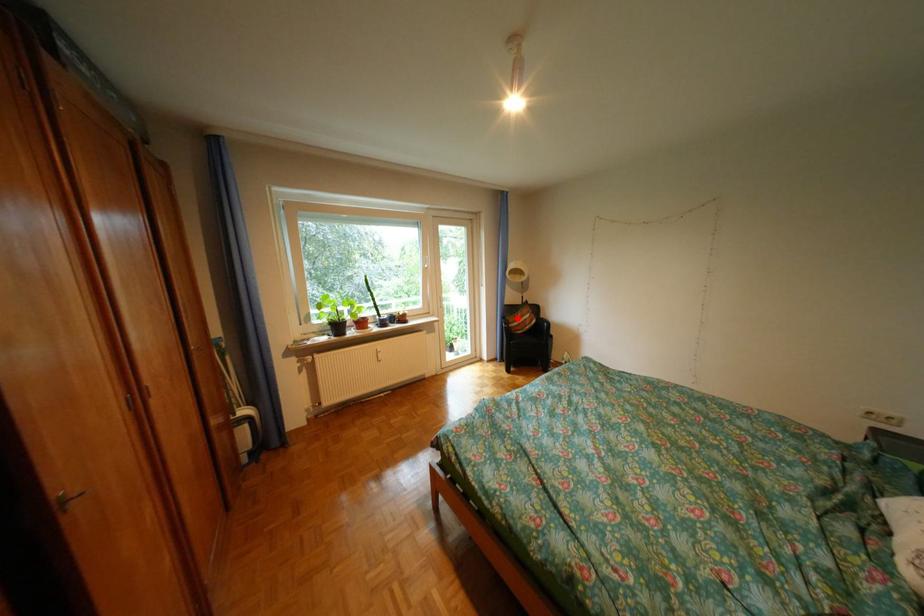
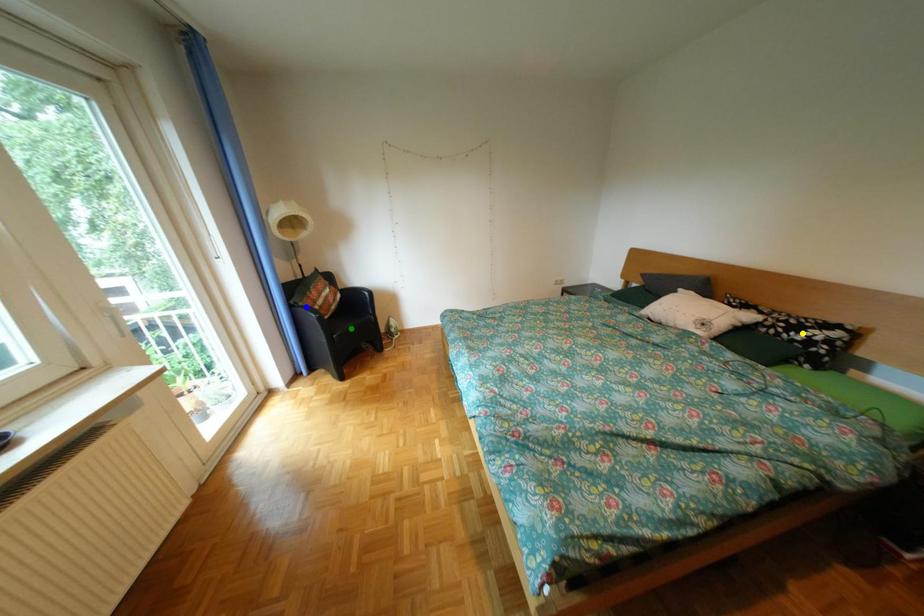
Question: I am providing you with two images of the same scene from different viewpoints. A red point is marked on the first image. You are given multiple points on the second image. Can you choose the point in image 2 that corresponds to the point in image 1?

Choices:
 (A) green point
 (B) yellow point
 (C) blue point

Answer: (C)